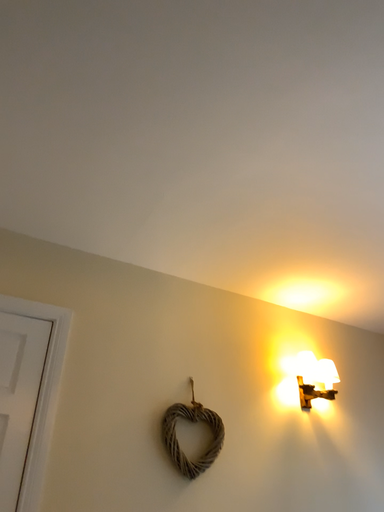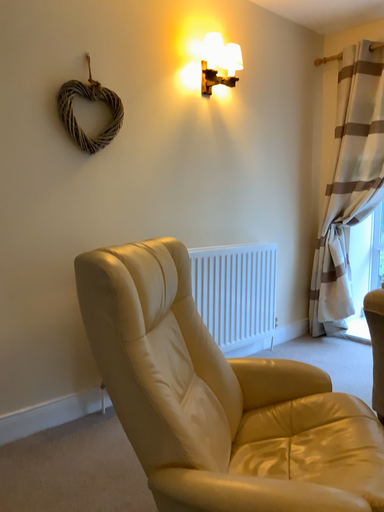
Question: How did the camera likely rotate when shooting the video?

Choices:
 (A) rotated downward
 (B) rotated upward

Answer: (A)